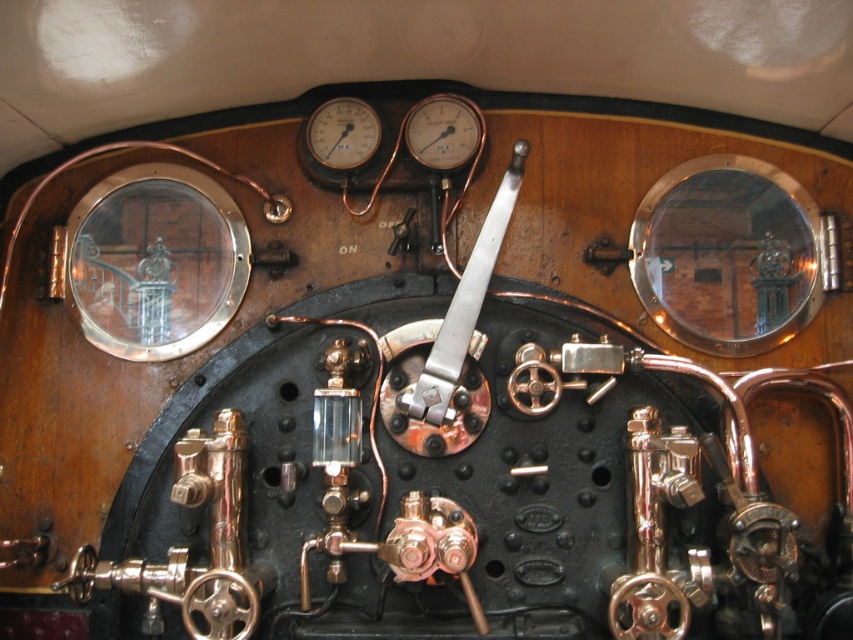
You are an engineer inspecting the control panel and need to locate both the matte black gauge at upper center and the matte brass gauge at upper center. Which one is located to the right of the other?

The matte black gauge at upper center is positioned on the right side of the matte brass gauge at upper center.

You are an engineer inspecting a vintage control panel. You need to locate the matte black gauge at upper center. According to the coordinates provided, where exactly should you look on the control panel?

The matte black gauge at upper center is located at point coordinates of 0.206 on the x axis and 0.521 on the y axis.

You are an engineer inspecting the control panel and need to adjust the matte black gauge at upper center and the matte brass gauge at upper center. Which gauge should you reach for first to make adjustments?

You should reach for the matte black gauge at upper center first because it is closer to you than the matte brass gauge at upper center.